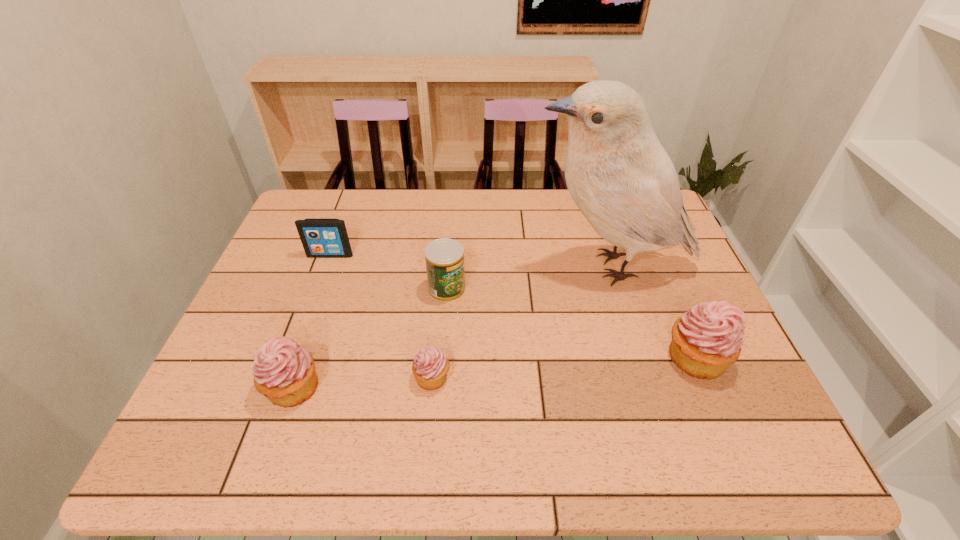
The image size is (960, 540). I want to click on free spot between the second tallest cupcake and the can, so click(x=370, y=338).

I want to click on vacant space in between the iPod and the second shortest cupcake, so click(312, 321).

Where is `free area in between the rightmost cupcake and the iPod`? This screenshot has width=960, height=540. free area in between the rightmost cupcake and the iPod is located at coordinates (513, 306).

At what (x,y) coordinates should I click in order to perform the action: click on unoccupied area between the iPod and the rightmost cupcake. Please return your answer as a coordinate pair (x, y). The image size is (960, 540). Looking at the image, I should click on (513, 306).

Locate an element on the screen. free space between the tallest object and the rightmost cupcake is located at coordinates (653, 312).

Identify the location of empty space that is in between the rightmost cupcake and the tallest object. (653, 312).

Find the location of a particular element. vacant space that's between the second tallest cupcake and the shortest object is located at coordinates (363, 382).

Locate an element on the screen. This screenshot has width=960, height=540. object that is the fifth closest to the shortest cupcake is located at coordinates (708, 338).

Find the location of a particular element. This screenshot has width=960, height=540. the second closest object to the tallest object is located at coordinates (444, 257).

The image size is (960, 540). I want to click on cupcake that is the closest to the shortest object, so click(284, 372).